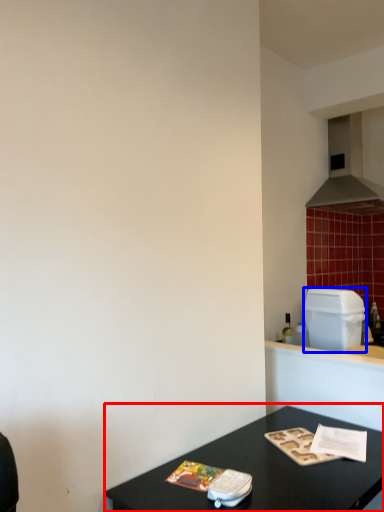
Question: Which of the following is the farthest to the observer, table (highlighted by a red box) or appliance (highlighted by a blue box)?

Choices:
 (A) table
 (B) appliance

Answer: (B)